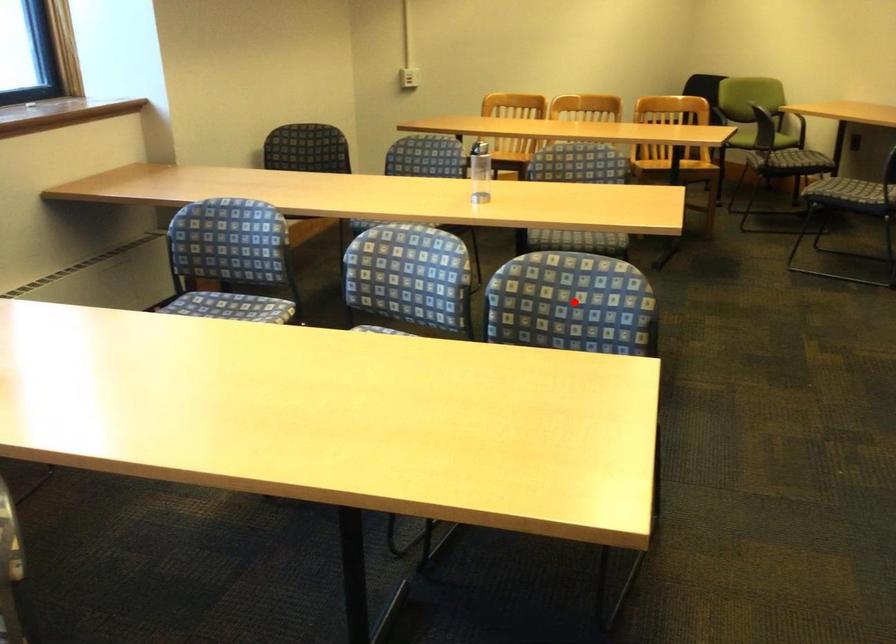
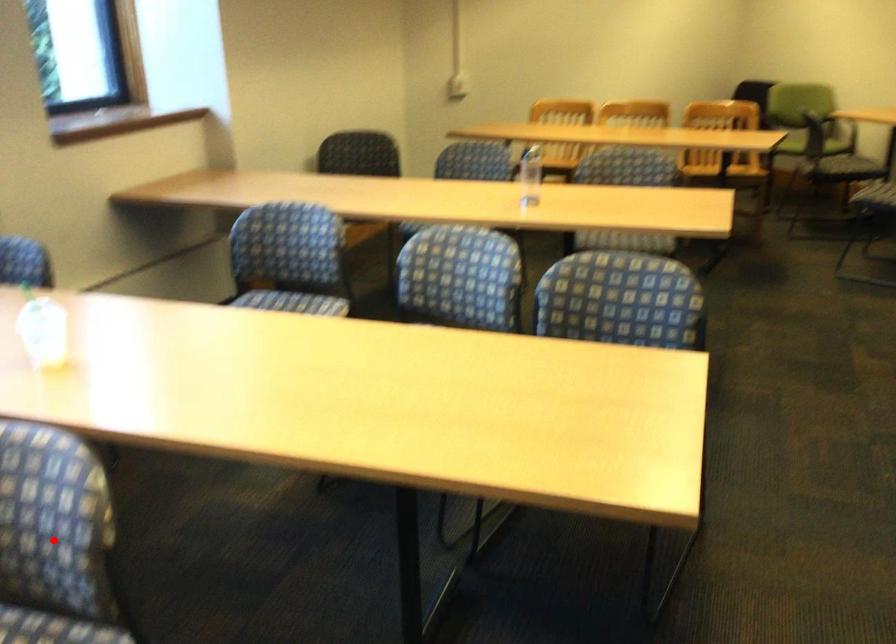
I am providing you with two images of the same scene from different viewpoints. A red point is marked on the first image and another point is marked on the second image. Is the marked point in image1 the same physical position as the marked point in image2?

No